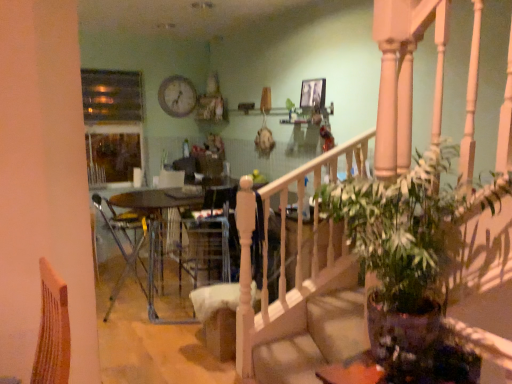
Question: Visually, is velvet beige armchair at center positioned to the left or to the right of wooden clock at upper center?

Choices:
 (A) left
 (B) right

Answer: (B)

Question: From the image's perspective, is velvet beige armchair at center positioned above or below wooden clock at upper center?

Choices:
 (A) below
 (B) above

Answer: (A)

Question: Estimate the real-world distances between objects in this image. Which object is farther from the metallic silver chair at center?

Choices:
 (A) green glossy houseplant at lower right
 (B) wooden clock at upper center
 (C) velvet beige armchair at center

Answer: (A)

Question: Estimate the real-world distances between objects in this image. Which object is closer to the wooden clock at upper center?

Choices:
 (A) metallic silver chair at center
 (B) green glossy houseplant at lower right
 (C) velvet beige armchair at center

Answer: (A)